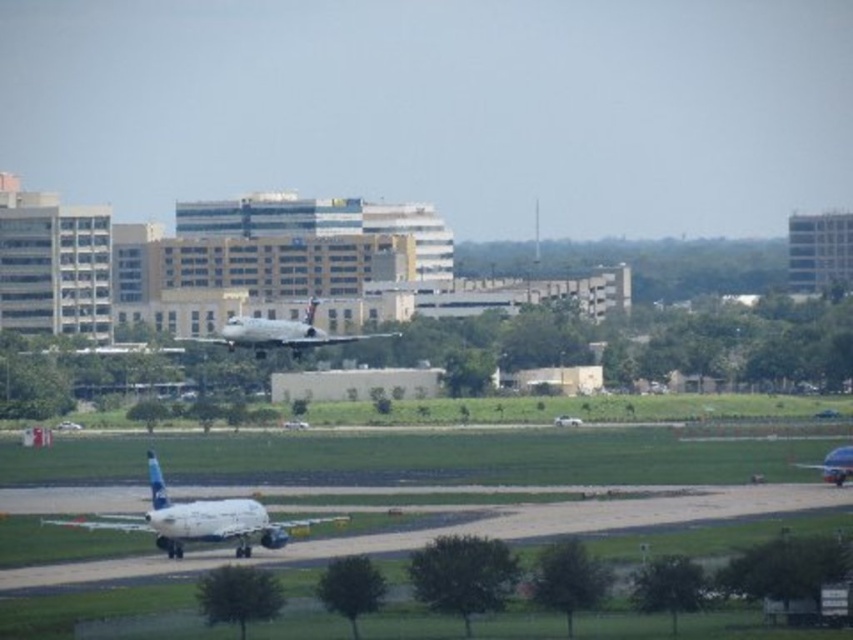
You are a pilot who needs to park your plane between the white matte airplane at lower left and the silver metallic airplane at center. Given their heights, which airplane should you position your plane closer to in order to maintain a safe vertical clearance?

The white matte airplane at lower left is much taller than the silver metallic airplane at center, so you should position your plane closer to the silver metallic airplane at center to maintain a safe vertical clearance.

You are a pilot observing the airport scene. You notice the white matte airplane at lower left and the silver metallic airplane at center. Which airplane would require a longer runway for takeoff based on their sizes?

The white matte airplane at lower left is larger in size than the silver metallic airplane at center, so it would require a longer runway for takeoff.